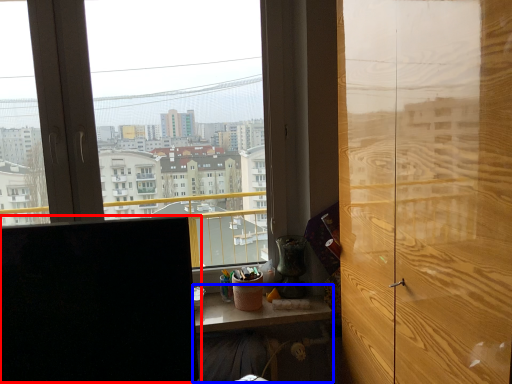
Question: Which object is further to the camera taking this photo, computer monitor (highlighted by a red box) or table (highlighted by a blue box)?

Choices:
 (A) computer monitor
 (B) table

Answer: (B)